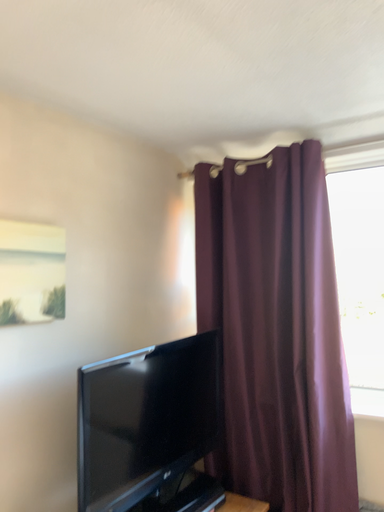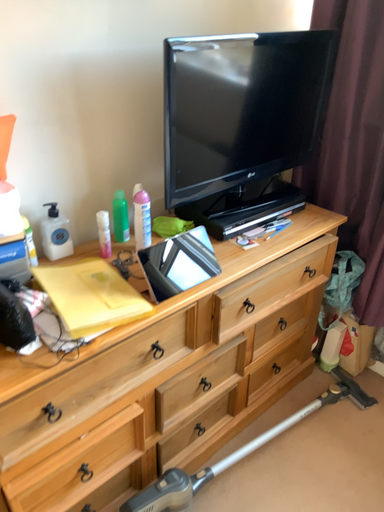
Question: Which way did the camera rotate in the video?

Choices:
 (A) rotated upward
 (B) rotated downward

Answer: (B)